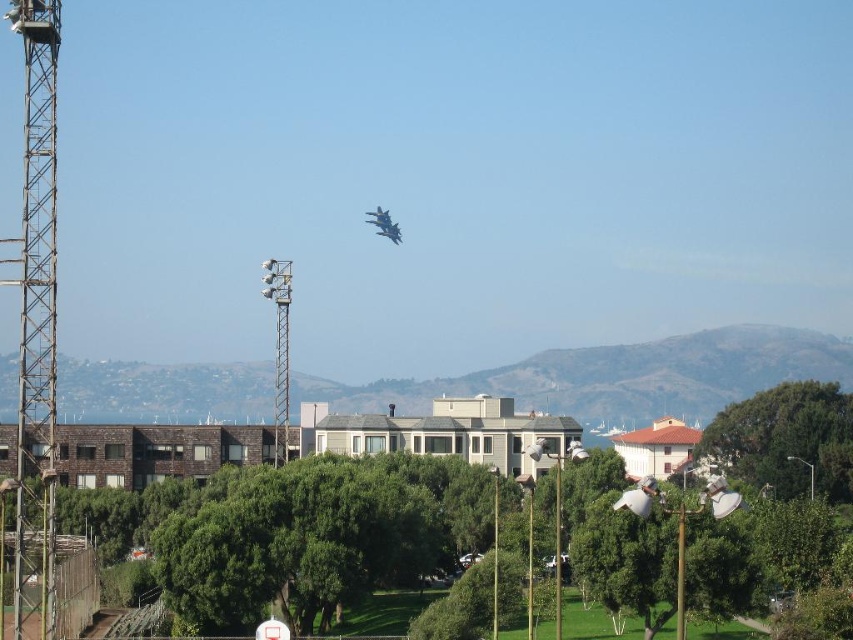
Is green leafy tree at center-right thinner than shiny blue jet at center?

No, green leafy tree at center-right is not thinner than shiny blue jet at center.

Who is taller, green leafy tree at center-right or shiny blue jet at center?

With more height is green leafy tree at center-right.

Between point (758, 456) and point (376, 225), which one is positioned behind?

The point (376, 225) is more distant.

Locate an element on the screen. The width and height of the screenshot is (853, 640). green leafy tree at center-right is located at coordinates (785, 440).

Can you confirm if metallic gray tower at left is positioned to the left of green leafy tree at center-right?

Yes, metallic gray tower at left is to the left of green leafy tree at center-right.

Is metallic gray tower at left below green leafy tree at center-right?

No.

Where is `metallic gray tower at left`? This screenshot has width=853, height=640. metallic gray tower at left is located at coordinates (36, 323).

Find the location of a particular element. The image size is (853, 640). metallic gray tower at left is located at coordinates (36, 323).

Which of these two, green leafy tree at center-right or metallic gray tower at center-left, stands taller?

Standing taller between the two is metallic gray tower at center-left.

Can you confirm if green leafy tree at center-right is thinner than metallic gray tower at center-left?

No.

The width and height of the screenshot is (853, 640). What do you see at coordinates (785, 440) in the screenshot?
I see `green leafy tree at center-right` at bounding box center [785, 440].

The height and width of the screenshot is (640, 853). I want to click on green leafy tree at center-right, so click(785, 440).